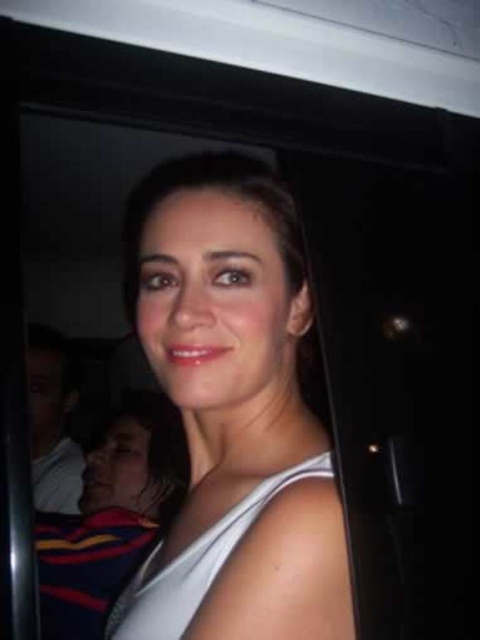
You are a photographer at a social event. You notice a person wearing a white matte tank top at center and a striped jersey at lower left. Which clothing item is positioned higher on their body?

The white matte tank top at center is positioned higher on their body than the striped jersey at lower left because it is above it.

In the scene shown: The person in the image is wearing two white items at the center. Which one, the white matte tank top at center or the white matte dress at center, extends higher up the body?

The white matte tank top at center extends higher up the body compared to the white matte dress at center because it has a greater height.

You are a photographer adjusting the lighting for a photoshoot. You notice the subject is wearing a white matte tank top at center and a white matte dress at center. Since both items are white, how can you ensure they are distinguishable in the final image?

The white matte tank top at center has a larger width than the white matte dress at center, so adjusting the lighting to highlight the broader silhouette of the tank top will help differentiate it from the dress.